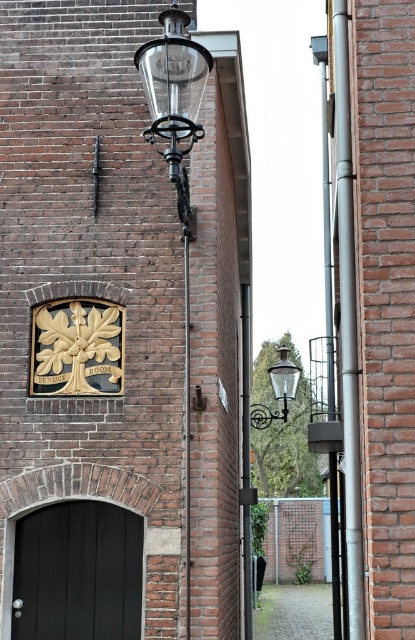
You are a city planner assessing the alleyway for lighting improvements. You notice the clear glass lamp post at upper left and the matte glass lamp at upper center. Which lamp is shorter in height?

The clear glass lamp post at upper left is shorter in height compared to the matte glass lamp at upper center.

You are standing at the entrance of the alleyway and want to walk straight ahead. Based on the image, where is the paved stone alley at lower center located in relation to your current position?

The paved stone alley at lower center is located at point [293,612] in the image, which is directly ahead and slightly to the right of your current position at the entrance.